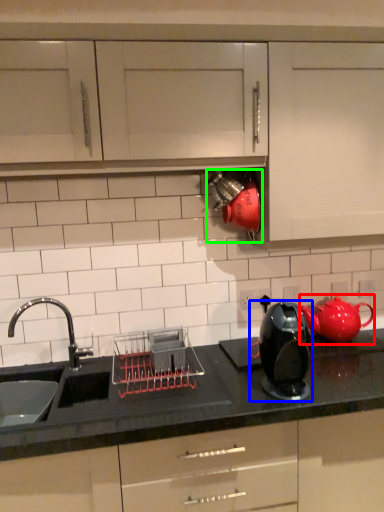
Question: Which object is positioned closest to tea pot (highlighted by a red box)? Select from home appliance (highlighted by a blue box) and appliance (highlighted by a green box).

Choices:
 (A) home appliance
 (B) appliance

Answer: (A)